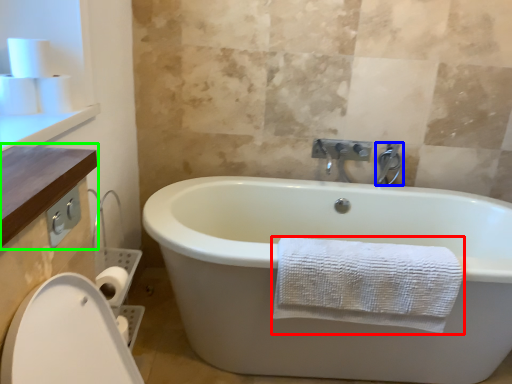
Question: Considering the real-world distances, which object is closest to towel (highlighted by a red box)? tap (highlighted by a blue box) or counter top (highlighted by a green box).

Choices:
 (A) tap
 (B) counter top

Answer: (B)